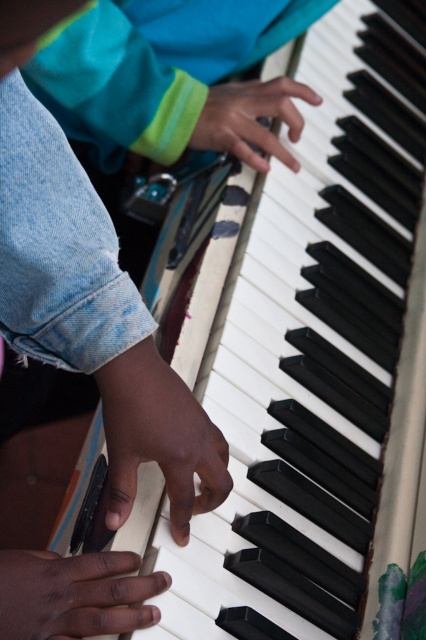
You are a photographer trying to capture the exact position of the hand in the image. The camera uses a coordinate system where the bottom left corner is the origin point. Can you determine the exact coordinates of the smooth skin hand at center?

The smooth skin hand at center is located at point coordinates of (x=158, y=438).

You are a photographer adjusting the lighting for a closeup shot of a pianist. You need to ensure both the dark skin hand at lower left and the matte black hand at center are well lit. Which hand might require additional lighting to be visible clearly?

The matte black hand at center has a greater height than the dark skin hand at lower left, so it might require additional lighting to ensure visibility since it is positioned higher and could cast shadows or be less illuminated depending on the light source.

You are a photographer trying to capture the hands of the person playing the piano. You want to ensure both the smooth skin hand at center and the dark skin hand at lower left are clearly visible in your photo. Based on their positions, which hand is closer to the camera?

The smooth skin hand at center is located above the dark skin hand at lower left, so the smooth skin hand at center is closer to the camera.